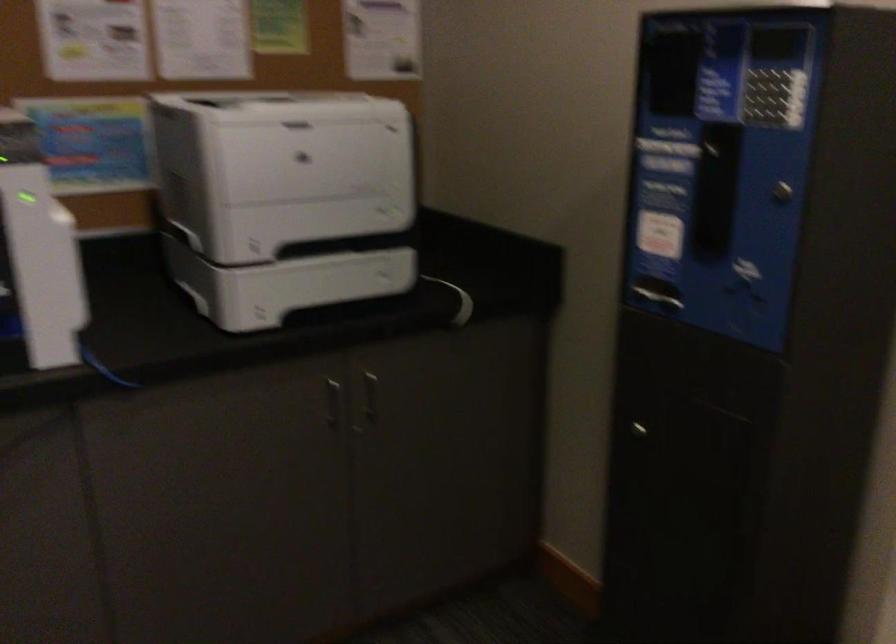
Locate an element on the screen. Image resolution: width=896 pixels, height=644 pixels. machine card slot is located at coordinates (x=780, y=44).